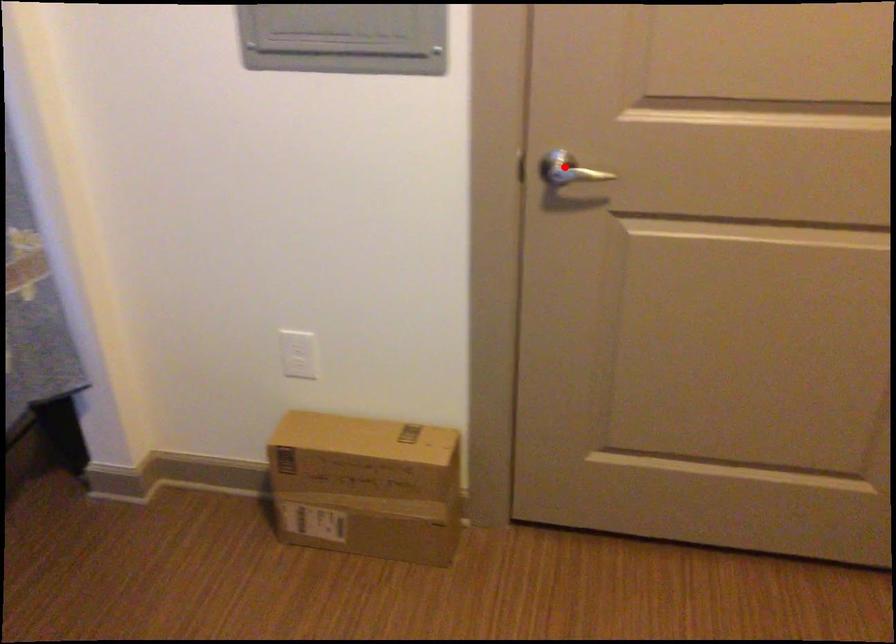
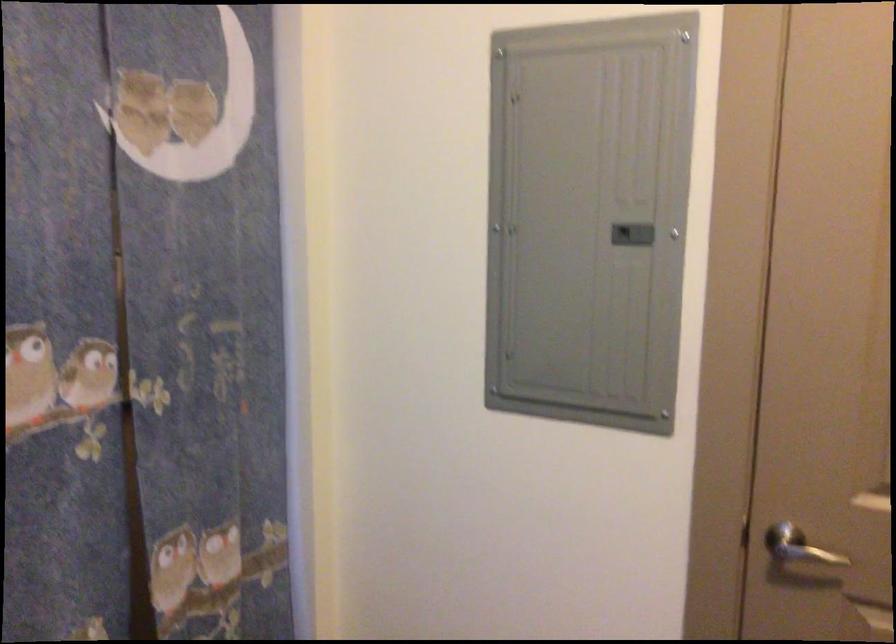
Where in the second image is the point corresponding to the highlighted location from the first image?

(806, 554)